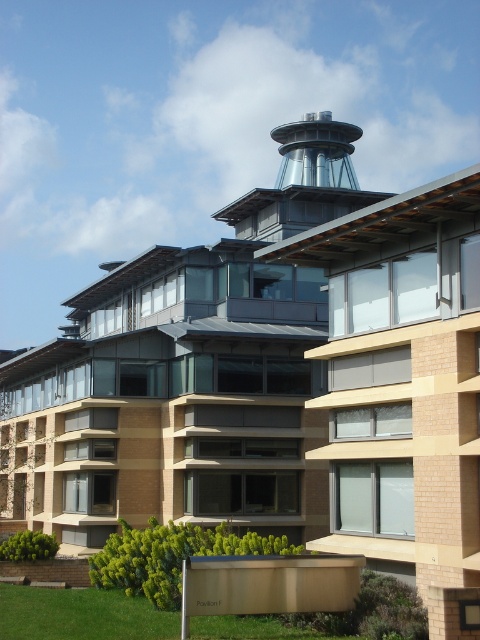
You are a drone operator planning to fly a drone near the building. The drone must avoid the metallic glass control tower at upper center. Given that the control tower is at coordinates point 0.284, 0.631, what is the safest direction to fly the drone away from the tower?

The metallic glass control tower at upper center is located at point (302, 180). To fly the drone safely away from it, you should direct it in the opposite direction of these coordinates, which would be towards the lower left or right areas of the building, ensuring a clear path away from the tower.